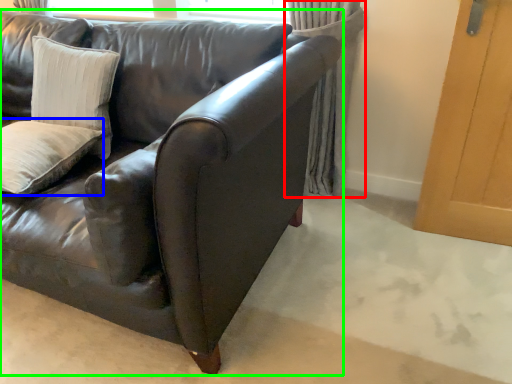
Question: Which object is positioned closest to curtain (highlighted by a red box)? Select from pillow (highlighted by a blue box) and studio couch (highlighted by a green box).

Choices:
 (A) pillow
 (B) studio couch

Answer: (B)